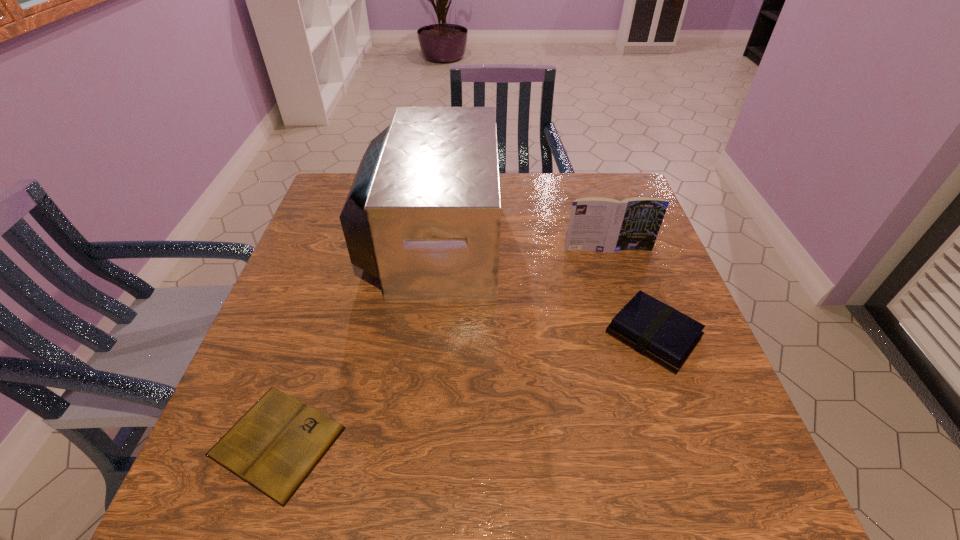
In the image, there is a desktop. Where is `free space at the far right corner`? The width and height of the screenshot is (960, 540). free space at the far right corner is located at coordinates (606, 193).

You are a GUI agent. You are given a task and a screenshot of the screen. Output one action in this format:
    pyautogui.click(x=<x>, y=<y>)
    Task: Click on the free space between the shortest book and the farthest book
    The image size is (960, 540).
    Given the screenshot: What is the action you would take?
    pyautogui.click(x=443, y=346)

Identify the location of free space that is in between the tallest book and the tallest object. The width and height of the screenshot is (960, 540). (520, 244).

This screenshot has height=540, width=960. I want to click on free spot between the nearest object and the microwave oven, so click(x=355, y=340).

You are a GUI agent. You are given a task and a screenshot of the screen. Output one action in this format:
    pyautogui.click(x=<x>, y=<y>)
    Task: Click on the empty space between the microwave oven and the second shortest book
    The height and width of the screenshot is (540, 960).
    Given the screenshot: What is the action you would take?
    pyautogui.click(x=542, y=287)

This screenshot has height=540, width=960. In order to click on free point between the microwave oven and the second nearest book in this screenshot , I will do `click(542, 287)`.

The height and width of the screenshot is (540, 960). In order to click on free spot between the third tallest object and the nearest object in this screenshot , I will do `click(465, 388)`.

At what (x,y) coordinates should I click in order to perform the action: click on free space that is in between the third shortest object and the second shortest object. Please return your answer as a coordinate pair (x, y). Looking at the image, I should click on (630, 293).

Identify the location of unoccupied area between the tallest object and the farthest book. (520, 244).

Locate an element on the screen. The width and height of the screenshot is (960, 540). unoccupied position between the shortest book and the microwave oven is located at coordinates (355, 340).